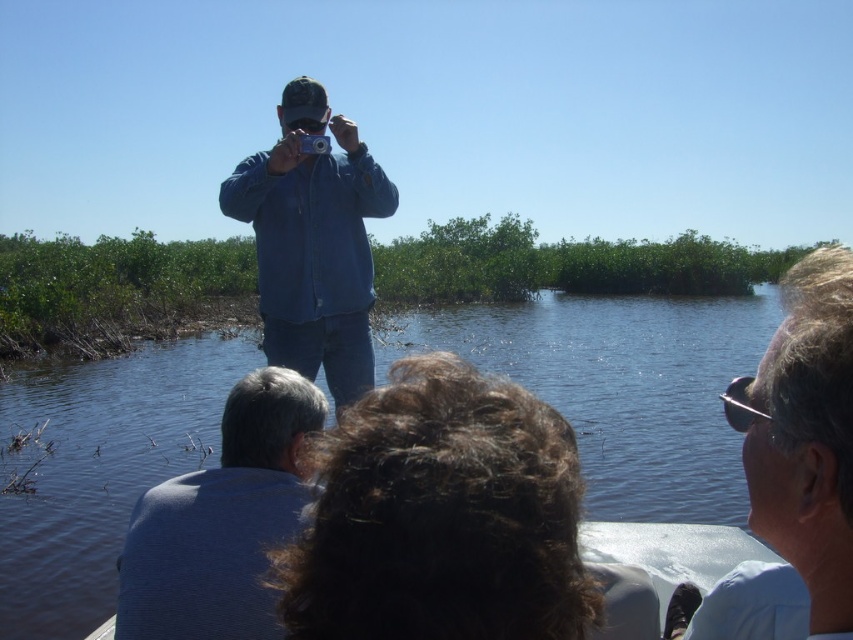
You are a photographer positioned at the edge of the wetland, aiming to capture a group photo of the two people wearing light blue shirt at upper right and blue striped shirt at lower left. Based on their positions, which one should you position on your right side to frame them properly?

The light blue shirt at upper right should be positioned on your right side because the light blue shirt at upper right is already to the right of the blue striped shirt at lower left in the scene.

You are a photographer standing at the edge of the wetland. You need to capture a photo of both the blue striped shirt at lower left and the blue denim shirt at center in the same frame. Given that your camera has a focal length of 50mm and the minimum distance between the two shirts to ensure they are both in focus is 2.5 meters, will you be able to take the photo successfully?

The blue striped shirt at lower left and blue denim shirt at center are 2.47 meters apart from each other. Since the minimum required distance is 2.5 meters, the distance between them is slightly less than required. Therefore, you might struggle to get both shirts in focus with a 50mm lens, as the distance is insufficient.

You are a photographer trying to capture the blue water at center and the blue denim shirt at center in the same frame. Which object should you focus on first if you want the larger one to be in sharp focus?

The blue water at center has a larger size compared to the blue denim shirt at center, so you should focus on the blue water at center first to ensure it is in sharp focus.